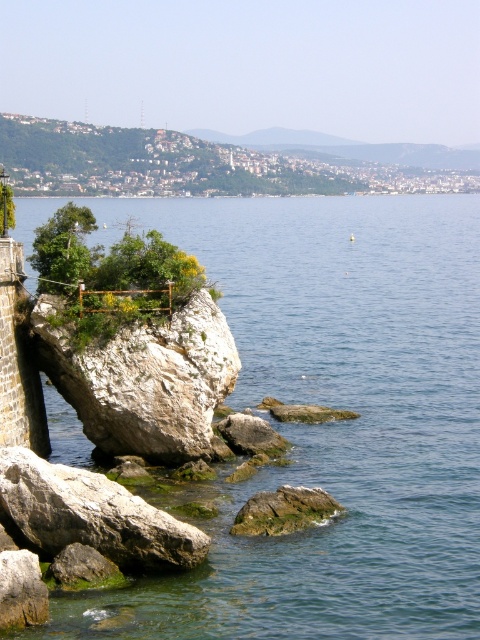
Question: Which point appears closest to the camera in this image?

Choices:
 (A) (105, 548)
 (B) (249, 500)
 (C) (466, 368)

Answer: (A)

Question: Estimate the real-world distances between objects in this image. Which object is closer to the green mossy rock at lower center?

Choices:
 (A) clear blue water at center
 (B) gray rough rock at lower left

Answer: (B)

Question: Does white rough rock at center appear under green mossy rock at lower center?

Choices:
 (A) no
 (B) yes

Answer: (A)

Question: Where is white rough rock at center located in relation to green mossy rock at lower center in the image?

Choices:
 (A) left
 (B) right

Answer: (A)

Question: Is clear blue water at center closer to camera compared to green mossy rock at lower center?

Choices:
 (A) no
 (B) yes

Answer: (B)

Question: Estimate the real-world distances between objects in this image. Which object is closer to the clear blue water at center?

Choices:
 (A) green mossy rock at lower center
 (B) white rough rock at center

Answer: (A)